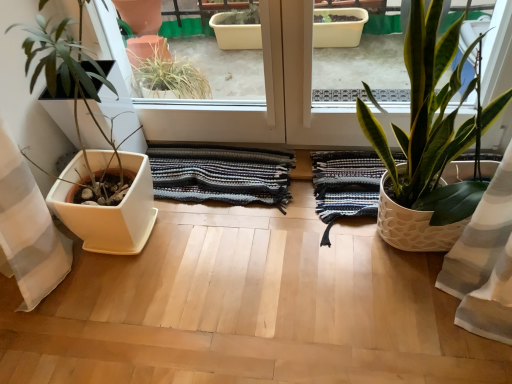
Question: Does white matte planter at left, placed as the second houseplant when sorted from right to left, have a greater width compared to white textured pot at right, positioned as the 2th houseplant in left-to-right order?

Choices:
 (A) no
 (B) yes

Answer: (B)

Question: Is white matte planter at left, placed as the second houseplant when sorted from right to left, at the right side of white textured pot at right, which is counted as the first houseplant, starting from the right?

Choices:
 (A) yes
 (B) no

Answer: (B)

Question: Is white matte planter at left, arranged as the 1th houseplant when viewed from the left, positioned beyond the bounds of white textured pot at right, positioned as the 2th houseplant in left-to-right order?

Choices:
 (A) no
 (B) yes

Answer: (B)

Question: Is white matte planter at left, arranged as the 1th houseplant when viewed from the left, oriented towards white textured pot at right, positioned as the 2th houseplant in left-to-right order?

Choices:
 (A) yes
 (B) no

Answer: (B)

Question: Is white matte planter at left, placed as the second houseplant when sorted from right to left, beside white textured pot at right, which is counted as the first houseplant, starting from the right?

Choices:
 (A) no
 (B) yes

Answer: (A)

Question: From a real-world perspective, is white matte planter at left, arranged as the 1th houseplant when viewed from the left, on top of white textured pot at right, which is counted as the first houseplant, starting from the right?

Choices:
 (A) no
 (B) yes

Answer: (B)

Question: Considering the relative sizes of striped cotton rug at center, the 1th bath towel viewed from the left, and white textured pot at right, which is counted as the first houseplant, starting from the right, in the image provided, is striped cotton rug at center, the 1th bath towel viewed from the left, wider than white textured pot at right, which is counted as the first houseplant, starting from the right,?

Choices:
 (A) yes
 (B) no

Answer: (B)

Question: Can you confirm if striped cotton rug at center, the 2th bath towel from the right, is bigger than white textured pot at right, which is counted as the first houseplant, starting from the right?

Choices:
 (A) yes
 (B) no

Answer: (B)

Question: Is striped cotton rug at center, the 2th bath towel from the right, at the right side of white textured pot at right, positioned as the 2th houseplant in left-to-right order?

Choices:
 (A) yes
 (B) no

Answer: (B)

Question: Is striped cotton rug at center, the 1th bath towel viewed from the left, not near white textured pot at right, positioned as the 2th houseplant in left-to-right order?

Choices:
 (A) no
 (B) yes

Answer: (A)

Question: Does striped cotton rug at center, the 1th bath towel viewed from the left, have a lesser height compared to white textured pot at right, which is counted as the first houseplant, starting from the right?

Choices:
 (A) yes
 (B) no

Answer: (A)

Question: From the image's perspective, is striped cotton rug at center, the 1th bath towel viewed from the left, beneath white textured pot at right, which is counted as the first houseplant, starting from the right?

Choices:
 (A) yes
 (B) no

Answer: (A)

Question: Considering the relative positions of white textured pot at right, positioned as the 2th houseplant in left-to-right order, and white matte planter at left, arranged as the 1th houseplant when viewed from the left, in the image provided, is white textured pot at right, positioned as the 2th houseplant in left-to-right order, to the right of white matte planter at left, arranged as the 1th houseplant when viewed from the left, from the viewer's perspective?

Choices:
 (A) no
 (B) yes

Answer: (B)